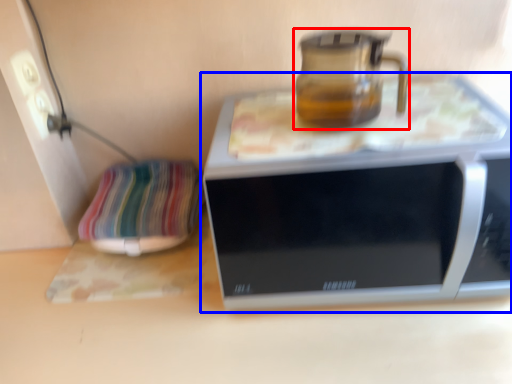
Question: Which object appears farthest to the camera in this image, jug (highlighted by a red box) or microwave oven (highlighted by a blue box)?

Choices:
 (A) jug
 (B) microwave oven

Answer: (A)